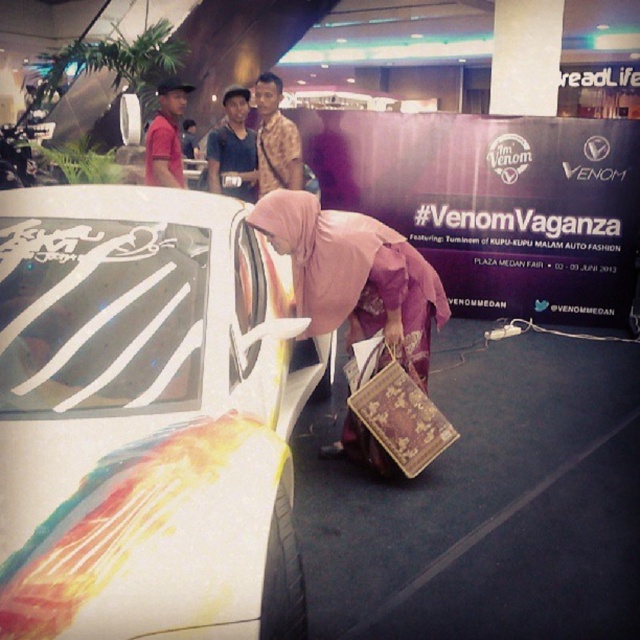
Question: Does pink fabric hijab at center appear on the right side of camouflage fabric shirt at center?

Choices:
 (A) no
 (B) yes

Answer: (B)

Question: Which of the following is the closest to the observer?

Choices:
 (A) camouflage fabric shirt at center
 (B) pink fabric hijab at center
 (C) shiny metallic car at center

Answer: (C)

Question: In this image, where is matte blue shirt at upper center located relative to matte red shirt at left?

Choices:
 (A) left
 (B) right

Answer: (B)

Question: Is the position of matte blue shirt at upper center more distant than that of matte red shirt at left?

Choices:
 (A) no
 (B) yes

Answer: (B)

Question: Among these points, which one is farthest from the camera?

Choices:
 (A) (348, 262)
 (B) (259, 131)

Answer: (B)

Question: Which of the following is the closest to the observer?

Choices:
 (A) matte blue shirt at upper center
 (B) camouflage fabric shirt at center
 (C) shiny metallic car at center

Answer: (C)